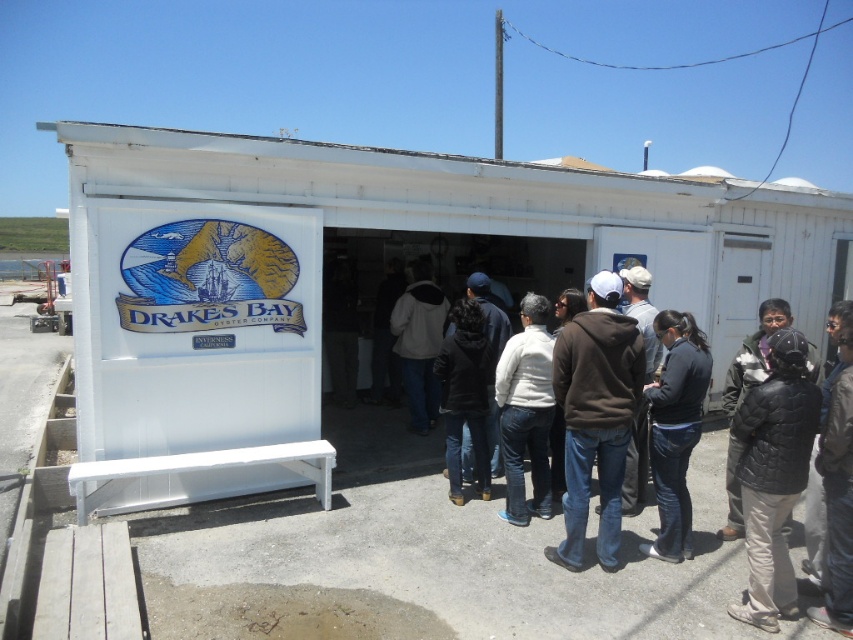
Can you confirm if denim jeans at center is shorter than dark brown hoodie at center?

No, denim jeans at center is not shorter than dark brown hoodie at center.

Does denim jeans at center have a greater height compared to dark brown hoodie at center?

Correct, denim jeans at center is much taller as dark brown hoodie at center.

The image size is (853, 640). I want to click on denim jeans at center, so click(675, 428).

Locate an element on the screen. white painted wood shed at center is located at coordinates (416, 250).

In order to click on white painted wood shed at center in this screenshot , I will do `click(416, 250)`.

Identify the location of white painted wood shed at center. Image resolution: width=853 pixels, height=640 pixels. (416, 250).

Is dark brown hoodie at center below matte gray hoodie at center?

Yes, dark brown hoodie at center is below matte gray hoodie at center.

Which of these two, dark brown hoodie at center or matte gray hoodie at center, stands taller?

Standing taller between the two is matte gray hoodie at center.

Is point (473, 333) closer to camera compared to point (415, 349)?

That is True.

This screenshot has height=640, width=853. I want to click on dark brown hoodie at center, so click(x=465, y=394).